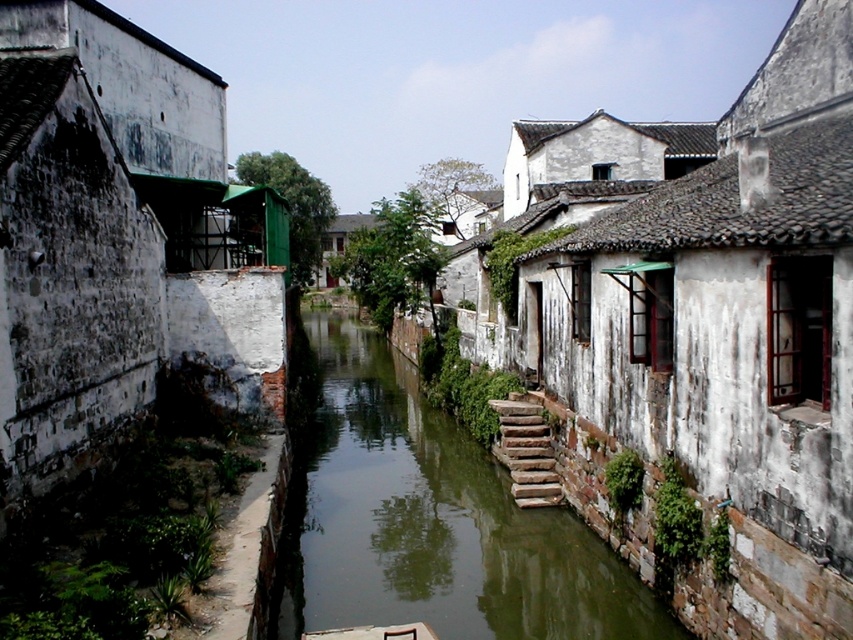
You are a delivery person trying to cross the canal in the image. You see the green mossy stone at center and the stone steps at center. Which one is wider and can support your cart?

The green mossy stone at center is wider than the stone steps at center, so it can support your cart.

You are standing at the edge of the canal in this traditional East Asian village scene. You notice the green mossy stone at center and the stone steps at center. Which object is nearer to you?

The green mossy stone at center is closer to the viewer than the stone steps at center, so the green mossy stone at center is nearer to you.

You are standing at the edge of the canal in the East Asian village scene. You see the green mossy stone at center and the stone steps at center. Which object is positioned lower in the scene?

The green mossy stone at center is positioned lower than the stone steps at center because it is located below them.